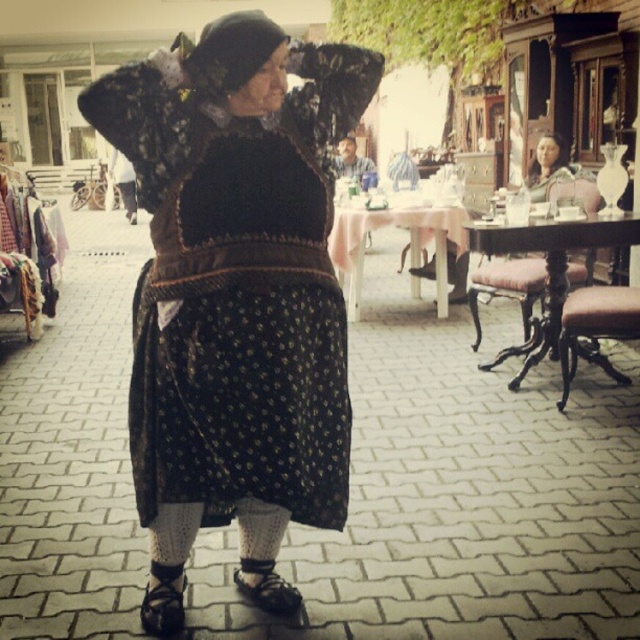
The width and height of the screenshot is (640, 640). What do you see at coordinates (237, 291) in the screenshot?
I see `black textured dress at center` at bounding box center [237, 291].

Is black textured dress at center bigger than brown leather stool at lower right?

Yes.

Does point (227, 241) come in front of point (612, 307)?

Yes.

The image size is (640, 640). I want to click on black textured dress at center, so click(x=237, y=291).